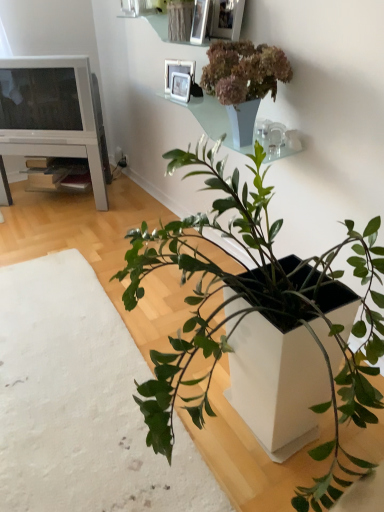
The image size is (384, 512). Describe the element at coordinates (226, 19) in the screenshot. I see `metallic silver picture frame at upper center, the fourth picture frame in the back-to-front sequence` at that location.

Image resolution: width=384 pixels, height=512 pixels. What do you see at coordinates (46, 98) in the screenshot?
I see `matte white television at upper left` at bounding box center [46, 98].

The height and width of the screenshot is (512, 384). Describe the element at coordinates (211, 119) in the screenshot. I see `translucent glass shelf at upper center` at that location.

This screenshot has width=384, height=512. What do you see at coordinates (256, 311) in the screenshot?
I see `green matte plant at center, which is counted as the 2th houseplant, starting from the right` at bounding box center [256, 311].

Locate an element on the screen. metallic silver picture frame at upper center, the fourth picture frame in the back-to-front sequence is located at coordinates (226, 19).

Does point (0, 91) come in front of point (170, 83)?

No, (0, 91) is behind (170, 83).

Looking at their sizes, would you say matte white television at upper left is wider or thinner than white glossy picture frame at upper center, which is the 1th picture frame in back-to-front order?

Considering their sizes, matte white television at upper left looks broader than white glossy picture frame at upper center, which is the 1th picture frame in back-to-front order.

Which of these two, matte white television at upper left or white glossy picture frame at upper center, which is the 1th picture frame in back-to-front order, stands taller?

matte white television at upper left.

Is the position of matte white television at upper left less distant than that of white glossy picture frame at upper center, which is counted as the 4th picture frame, starting from the front?

No, matte white television at upper left is behind white glossy picture frame at upper center, which is counted as the 4th picture frame, starting from the front.

From a real-world perspective, which object stands above the other?

white glossy picture frame at upper center, which is counted as the 4th picture frame, starting from the front, from a real-world perspective.

Can you confirm if white glossy picture frame at upper center, which is counted as the 4th picture frame, starting from the front, is taller than matte white television at upper left?

No.

Is white glossy picture frame at upper center, which is the 1th picture frame in back-to-front order, looking in the opposite direction of matte white television at upper left?

No, matte white television at upper left is not at the back of white glossy picture frame at upper center, which is the 1th picture frame in back-to-front order.

From a real-world perspective, is metallic silver picture frame at upper center, the fourth picture frame in the back-to-front sequence, beneath white glossy picture frame at upper center, which is counted as the 4th picture frame, starting from the front?

Incorrect, from a real-world perspective, metallic silver picture frame at upper center, the fourth picture frame in the back-to-front sequence, is higher than white glossy picture frame at upper center, which is counted as the 4th picture frame, starting from the front.

Is point (228, 1) farther from viewer compared to point (169, 62)?

No, (228, 1) is closer to viewer.

Considering the sizes of objects metallic silver picture frame at upper center, the first picture frame in the front-to-back sequence, and white glossy picture frame at upper center, which is the 1th picture frame in back-to-front order, in the image provided, who is smaller, metallic silver picture frame at upper center, the first picture frame in the front-to-back sequence, or white glossy picture frame at upper center, which is the 1th picture frame in back-to-front order,?

Smaller between the two is white glossy picture frame at upper center, which is the 1th picture frame in back-to-front order.

What's the angular difference between green matte plant at center, acting as the 1th houseplant starting from the left, and metallic silver picture frame at upper center, marked as the second picture frame in a back-to-front arrangement,'s facing directions?

They differ by 97.6 degrees in their facing directions.

Is green matte plant at center, acting as the 1th houseplant starting from the left, to the left of metallic silver picture frame at upper center, marked as the second picture frame in a back-to-front arrangement, from the viewer's perspective?

Correct, you'll find green matte plant at center, acting as the 1th houseplant starting from the left, to the left of metallic silver picture frame at upper center, marked as the second picture frame in a back-to-front arrangement.

From a real-world perspective, which object rests below the other?

green matte plant at center, which is counted as the 2th houseplant, starting from the right.

Looking at this image, is green matte plant at center, which is counted as the 2th houseplant, starting from the right, not inside metallic silver picture frame at upper center, marked as the second picture frame in a back-to-front arrangement?

Yes, green matte plant at center, which is counted as the 2th houseplant, starting from the right, is located beyond the bounds of metallic silver picture frame at upper center, marked as the second picture frame in a back-to-front arrangement.

From a real-world perspective, which is physically above, green matte plant at center, acting as the 1th houseplant starting from the left, or translucent glass shelf at upper center?

In real-world perspective, translucent glass shelf at upper center is above.

Is green matte plant at center, acting as the 1th houseplant starting from the left, oriented away from translucent glass shelf at upper center?

green matte plant at center, acting as the 1th houseplant starting from the left, does not have its back to translucent glass shelf at upper center.

Does point (246, 238) appear closer or farther from the camera than point (251, 150)?

Point (246, 238) is positioned closer to the camera compared to point (251, 150).

From the image's perspective, does green matte plant at center, acting as the 1th houseplant starting from the left, appear higher than translucent glass shelf at upper center?

Actually, green matte plant at center, acting as the 1th houseplant starting from the left, appears below translucent glass shelf at upper center in the image.

Can green matte plant at lower right be found inside green matte plant at center, which is counted as the 2th houseplant, starting from the right?

Indeed, green matte plant at lower right is located within green matte plant at center, which is counted as the 2th houseplant, starting from the right.

Based on their positions, is green matte plant at center, acting as the 1th houseplant starting from the left, located to the left or right of green matte plant at lower right?

green matte plant at center, acting as the 1th houseplant starting from the left, is positioned on green matte plant at lower right's left side.

Is green matte plant at center, which is counted as the 2th houseplant, starting from the right, next to green matte plant at lower right and touching it?

They are not placed beside each other.

Which of these two, green matte plant at center, acting as the 1th houseplant starting from the left, or green matte plant at lower right, stands shorter?

green matte plant at lower right.

Looking at this image, from a real-world perspective, between green matte plant at lower right and translucent glass shelf at upper center, who is vertically higher?

In real-world perspective, translucent glass shelf at upper center is above.

At what (x,y) coordinates should I click in order to perform the action: click on plain in front of the translucent glass shelf at upper center. Please return your answer as a coordinate pair (x, y). The height and width of the screenshot is (512, 384). Looking at the image, I should click on (81, 403).

Is green matte plant at lower right not close to translucent glass shelf at upper center?

Yes, green matte plant at lower right is far from translucent glass shelf at upper center.

In the image, there is a white glossy picture frame at upper center, which is counted as the 4th picture frame, starting from the front. Where is `television below it (from a real-world perspective)`? This screenshot has height=512, width=384. television below it (from a real-world perspective) is located at coordinates (46, 98).

From the image's perspective, which picture frame is the 3rd one below the matte white television at upper left? Please provide its 2D coordinates.

[(178, 71)]

Which object lies further to the anchor point translucent glass shelf at upper center, green matte plant at lower right or metallic silver picture frame at upper center, which appears as the second picture frame when viewed from the front?

green matte plant at lower right lies further to translucent glass shelf at upper center than the other object.

Looking at this image, estimate the real-world distances between objects in this image. Which object is closer to white wood entertainment center at left, metallic silver picture frame at upper center, marked as the second picture frame in a back-to-front arrangement, or matte gray vase at upper center, the 2th houseplant when ordered from left to right?

The object closer to white wood entertainment center at left is metallic silver picture frame at upper center, marked as the second picture frame in a back-to-front arrangement.

When comparing their distances from green matte plant at center, which is counted as the 2th houseplant, starting from the right, does translucent glass shelf at upper center or metallic silver picture frame at upper center, the third picture frame from the front, seem further?

metallic silver picture frame at upper center, the third picture frame from the front, is positioned further to the anchor green matte plant at center, which is counted as the 2th houseplant, starting from the right.

When comparing their distances from white glossy picture frame at upper center, which is the 1th picture frame in back-to-front order, does metallic silver picture frame at upper center, which appears as the second picture frame when viewed from the front, or green matte plant at center, which is counted as the 2th houseplant, starting from the right, seem closer?

The object closer to white glossy picture frame at upper center, which is the 1th picture frame in back-to-front order, is metallic silver picture frame at upper center, which appears as the second picture frame when viewed from the front.

When comparing their distances from matte white television at upper left, does green matte plant at center, which is counted as the 2th houseplant, starting from the right, or green matte plant at lower right seem closer?

green matte plant at lower right is positioned closer to the anchor matte white television at upper left.

From the image, which object appears to be nearer to white wood entertainment center at left, green matte plant at lower right or metallic silver picture frame at upper center, placed as the 3th picture frame when sorted from back to front?

metallic silver picture frame at upper center, placed as the 3th picture frame when sorted from back to front, is positioned closer to the anchor white wood entertainment center at left.

Which object lies further to the anchor point metallic silver picture frame at upper center, the third picture frame from the front, matte gray vase at upper center, which is counted as the first houseplant, starting from the right, or green matte plant at center, which is counted as the 2th houseplant, starting from the right?

green matte plant at center, which is counted as the 2th houseplant, starting from the right, is further to metallic silver picture frame at upper center, the third picture frame from the front.

Based on their spatial positions, is matte white television at upper left or matte gray vase at upper center, the 2th houseplant when ordered from left to right, closer to green matte plant at lower right?

matte gray vase at upper center, the 2th houseplant when ordered from left to right.

You are a GUI agent. You are given a task and a screenshot of the screen. Output one action in this format:
    pyautogui.click(x=<x>, y=<y>)
    Task: Click on the shelf that lies between matte white television at upper left and green matte plant at lower right from top to bottom
    This screenshot has width=384, height=512.
    Given the screenshot: What is the action you would take?
    pyautogui.click(x=211, y=119)

The image size is (384, 512). Find the location of `houseplant between translucent glass shelf at upper center and green matte plant at lower right from top to bottom`. houseplant between translucent glass shelf at upper center and green matte plant at lower right from top to bottom is located at coordinates point(256,311).

Where is `television between green matte plant at center, acting as the 1th houseplant starting from the left, and white wood entertainment center at left in the front-back direction`? The image size is (384, 512). television between green matte plant at center, acting as the 1th houseplant starting from the left, and white wood entertainment center at left in the front-back direction is located at coordinates (46, 98).

The width and height of the screenshot is (384, 512). I want to click on shelf between metallic silver picture frame at upper center, the fourth picture frame in the back-to-front sequence, and green matte plant at center, acting as the 1th houseplant starting from the left, in the up-down direction, so click(211, 119).